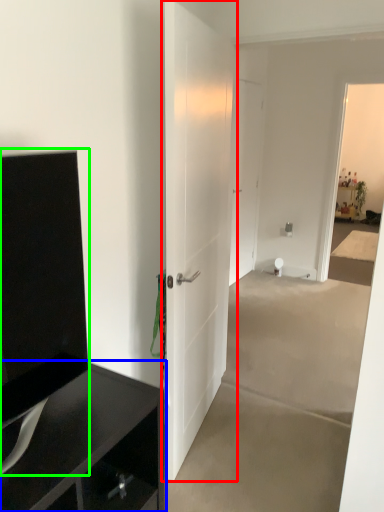
Question: Based on their relative distances, which object is nearer to door (highlighted by a red box)? Choose from cabinetry (highlighted by a blue box) and tv cabinet (highlighted by a green box).

Choices:
 (A) cabinetry
 (B) tv cabinet

Answer: (A)